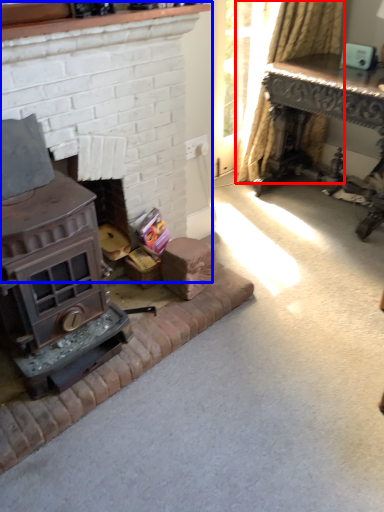
Question: Which object appears closest to the camera in this image, curtain (highlighted by a red box) or fireplace (highlighted by a blue box)?

Choices:
 (A) curtain
 (B) fireplace

Answer: (B)